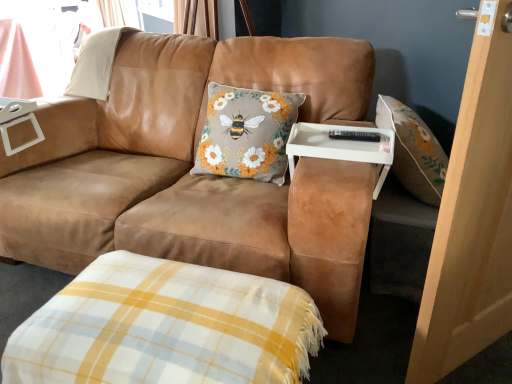
Question: In terms of width, does light brown wood screen door at right look wider or thinner when compared to suede brown couch at center?

Choices:
 (A) wide
 (B) thin

Answer: (B)

Question: Considering the positions of light brown wood screen door at right and suede brown couch at center in the image, is light brown wood screen door at right bigger or smaller than suede brown couch at center?

Choices:
 (A) big
 (B) small

Answer: (B)

Question: Estimate the real-world distances between objects in this image. Which object is closer to the white plastic tray at center?

Choices:
 (A) suede brown couch at center
 (B) light brown wood screen door at right
 (C) yellow and white plaid blanket at lower center

Answer: (B)

Question: Which is farther from the white plastic tray at center?

Choices:
 (A) suede brown couch at center
 (B) light brown wood screen door at right
 (C) yellow and white plaid blanket at lower center

Answer: (C)